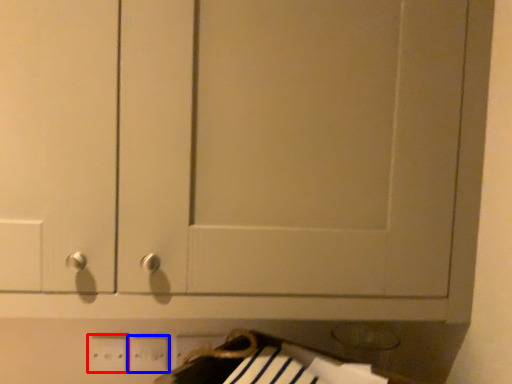
Question: Which point is further to the camera, electric outlet (highlighted by a red box) or electric outlet (highlighted by a blue box)?

Choices:
 (A) electric outlet
 (B) electric outlet

Answer: (B)